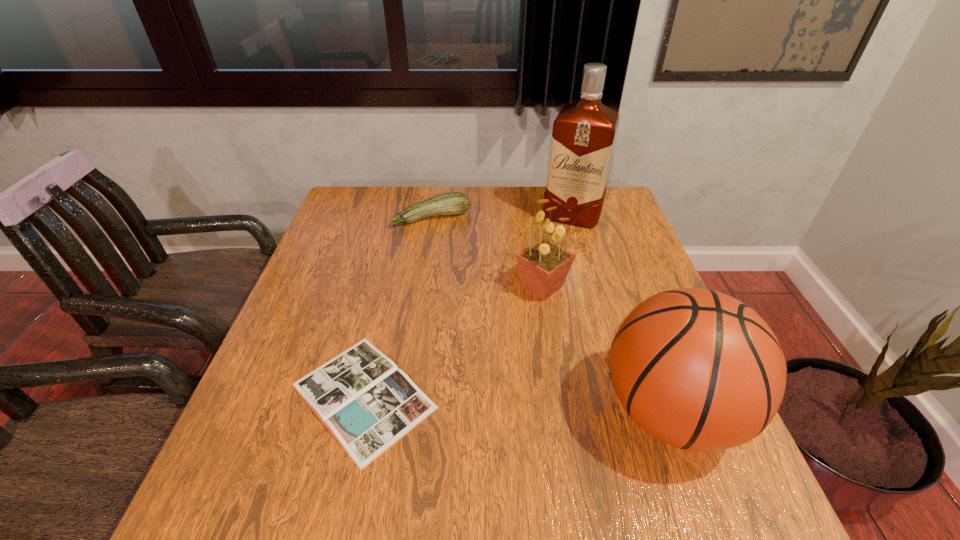
The width and height of the screenshot is (960, 540). Identify the location of free space on the desktop that is between the shortest object and the basketball and is positioned at the stem end of the second shortest object. (524, 404).

At what (x,y) coordinates should I click in order to perform the action: click on free space on the desktop that is between the book and the basketball and is positioned on the front label of the liquor. Please return your answer as a coordinate pair (x, y). Image resolution: width=960 pixels, height=540 pixels. Looking at the image, I should click on (498, 403).

Locate an element on the screen. Image resolution: width=960 pixels, height=540 pixels. free space on the desktop that is between the book and the basketball and is positioned at the front of the sunflower with flowers visible is located at coordinates (560, 406).